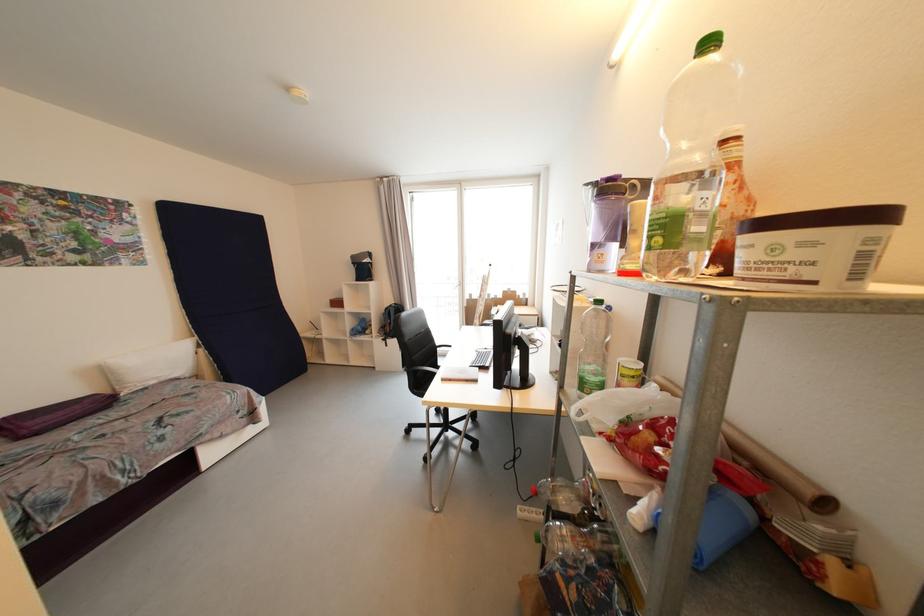
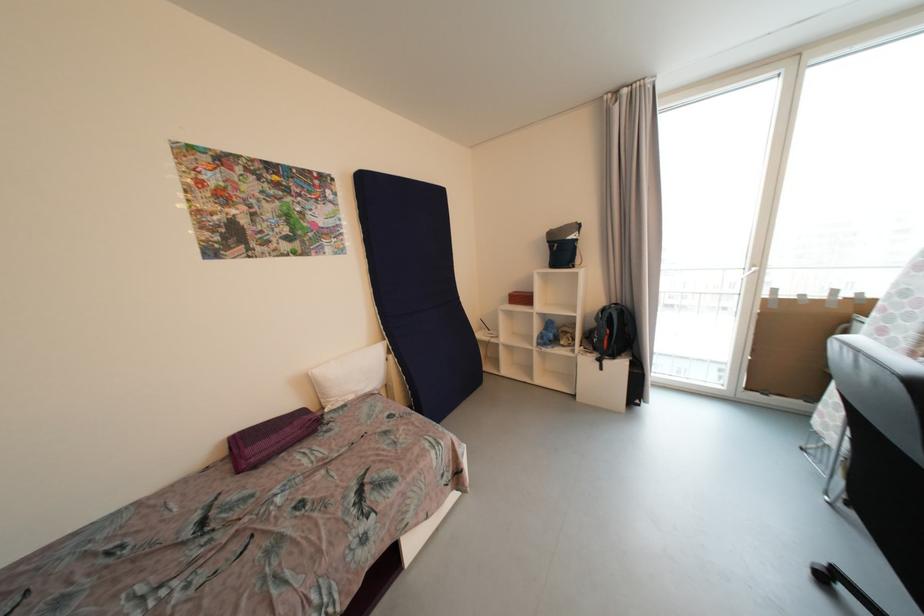
Locate, in the second image, the point that corresponds to point (392, 310) in the first image.

(608, 312)